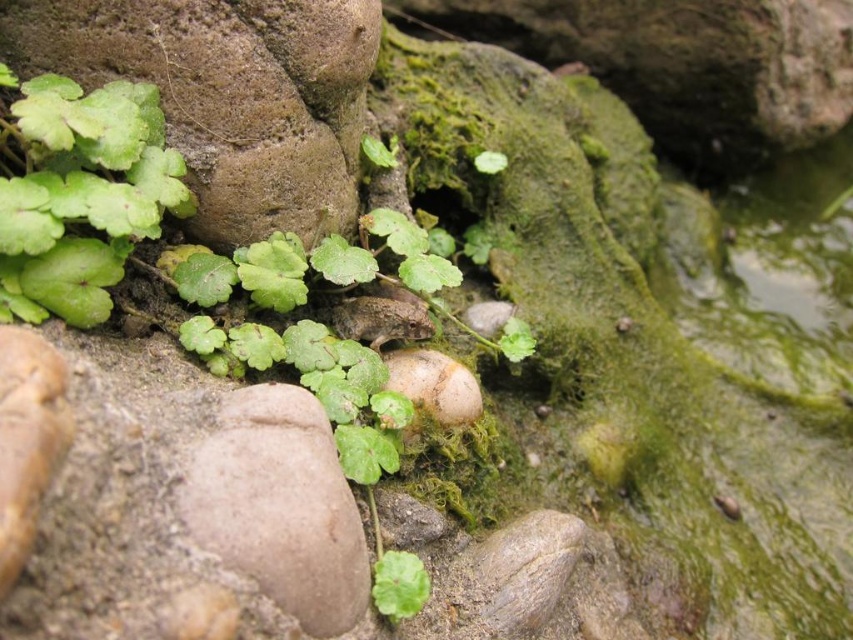
Question: Among these points, which one is nearest to the camera?

Choices:
 (A) (299, 172)
 (B) (44, 202)

Answer: (B)

Question: Is brown rough stone at center-left positioned behind green matte leaf at upper left?

Choices:
 (A) yes
 (B) no

Answer: (A)

Question: Does brown rough stone at center-left have a smaller size compared to green matte leaf at upper left?

Choices:
 (A) yes
 (B) no

Answer: (B)

Question: Which of the following is the farthest from the observer?

Choices:
 (A) brown rough stone at center-left
 (B) green matte leaf at upper left

Answer: (A)

Question: Can you confirm if brown rough stone at center-left is positioned to the left of green matte leaf at upper left?

Choices:
 (A) yes
 (B) no

Answer: (B)